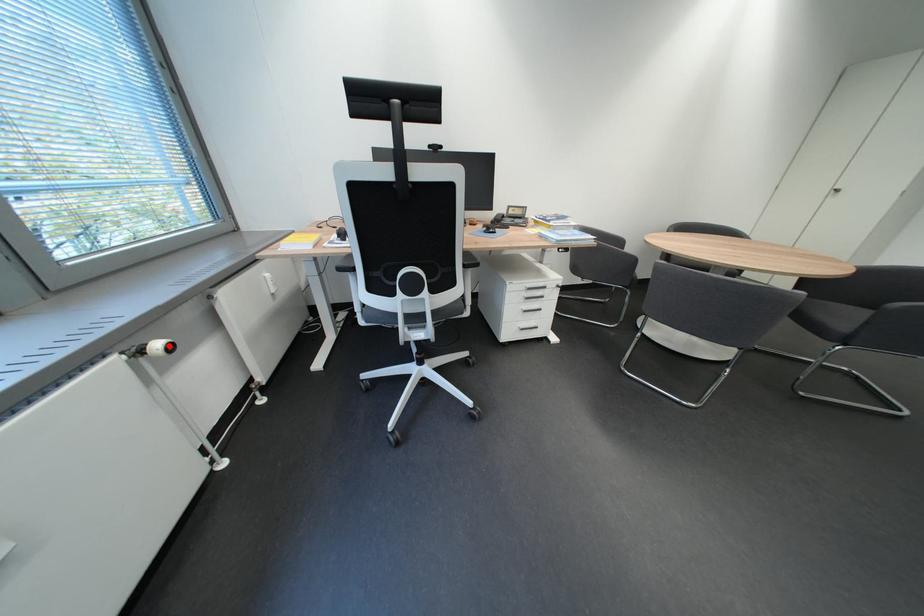
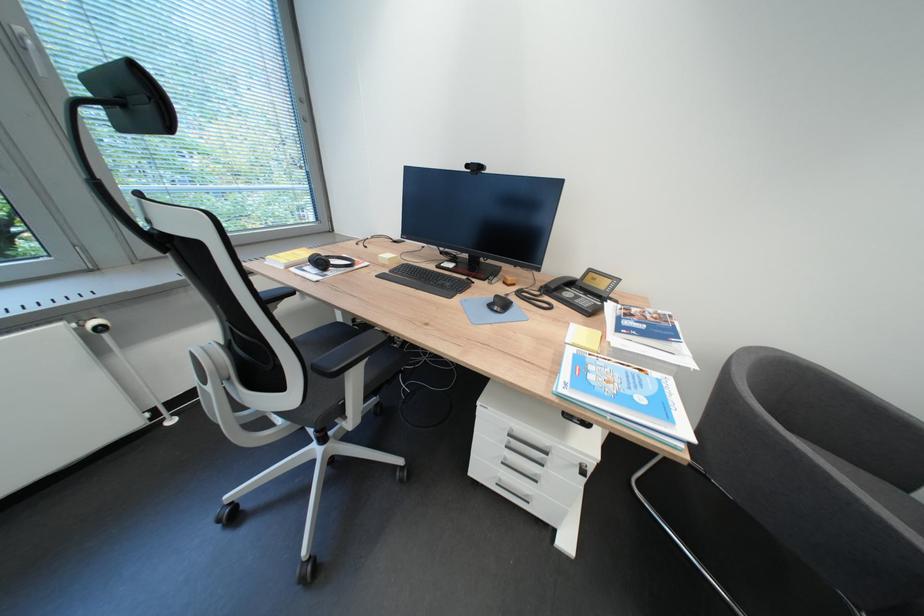
In the second image, find the point that corresponds to the highlighted location in the first image.

(106, 325)